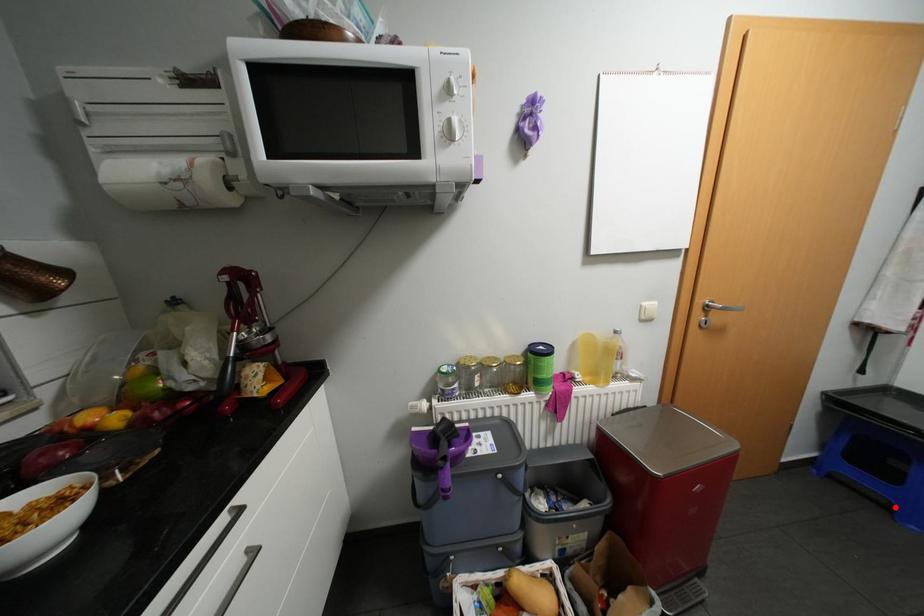
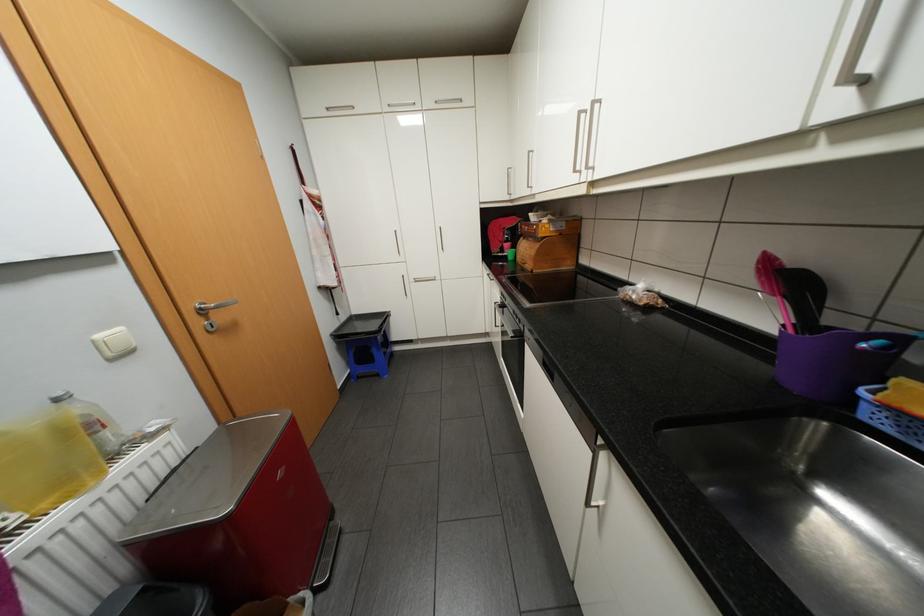
Question: I am providing you with two images of the same scene from different viewpoints. Given a red point in image1, look at the same physical point in image2. Is it:

Choices:
 (A) Closer to the viewpoint
 (B) Farther from the viewpoint

Answer: (A)